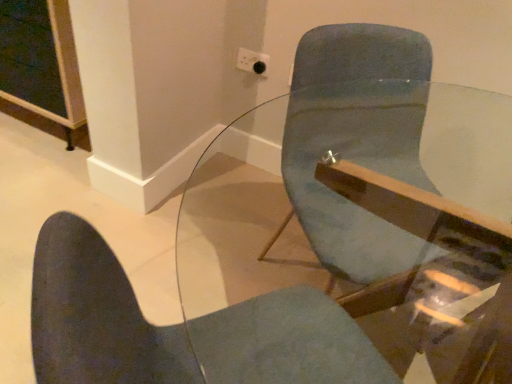
Question: From a real-world perspective, is transparent glass table at center positioned above or below white plastic socket at upper center?

Choices:
 (A) below
 (B) above

Answer: (A)

Question: Is point (264, 130) closer or farther from the camera than point (259, 54)?

Choices:
 (A) closer
 (B) farther

Answer: (B)

Question: Which of these objects is positioned closest to the white plastic socket at upper center?

Choices:
 (A) transparent glass table at center
 (B) matte blue chair at center

Answer: (A)

Question: Which of these objects is positioned closest to the white plastic socket at upper center?

Choices:
 (A) transparent glass table at center
 (B) matte blue chair at center

Answer: (A)